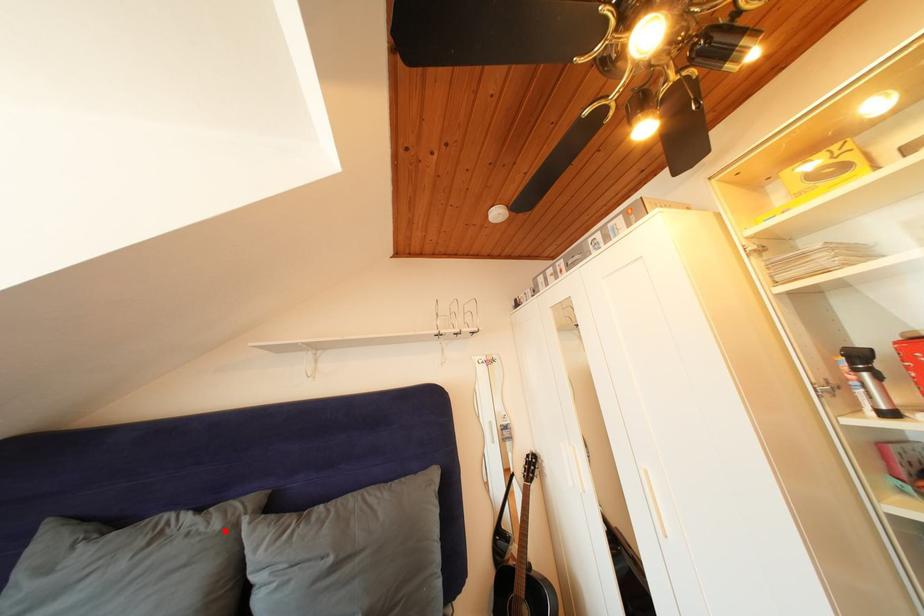
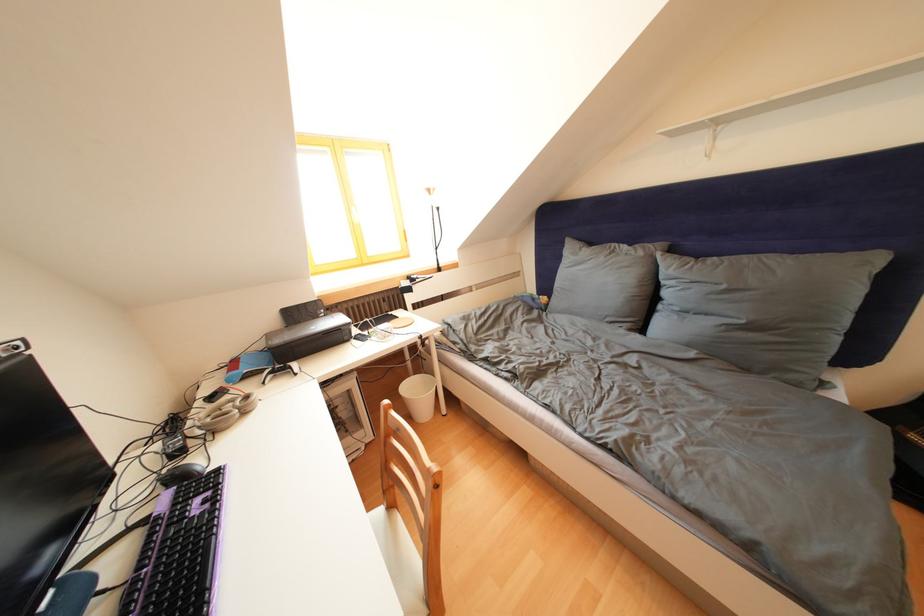
The point at the highlighted location is marked in the first image. Where is the corresponding point in the second image?

(649, 259)